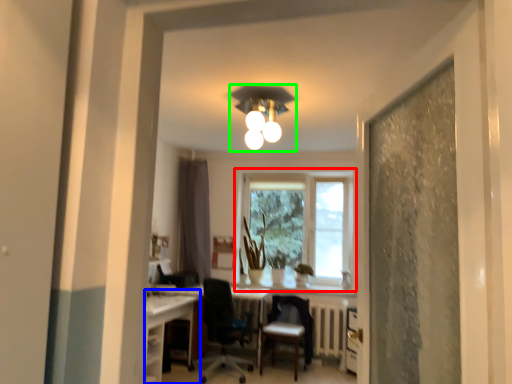
Question: Which object is positioned closest to window (highlighted by a red box)? Select from computer desk (highlighted by a blue box) and light fixture (highlighted by a green box).

Choices:
 (A) computer desk
 (B) light fixture

Answer: (B)